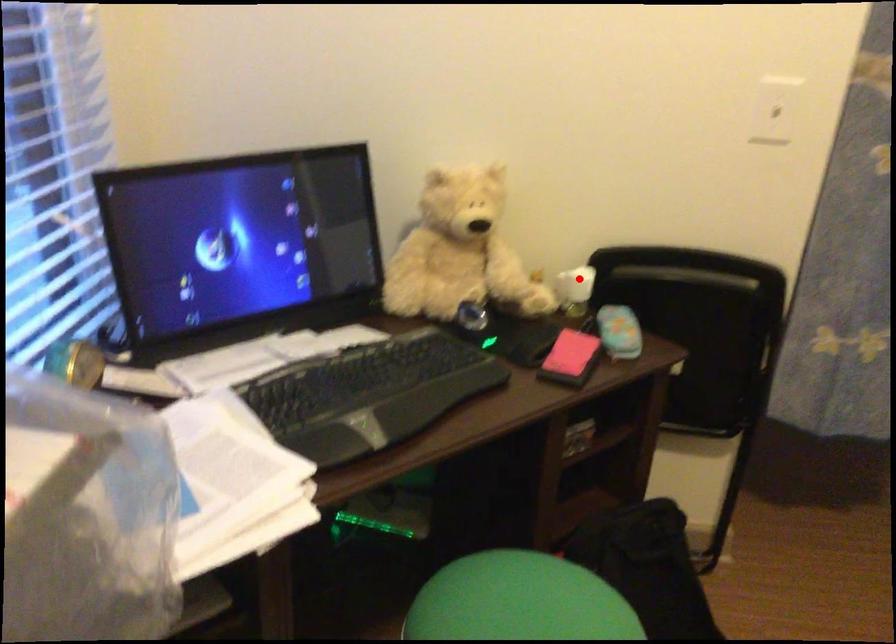
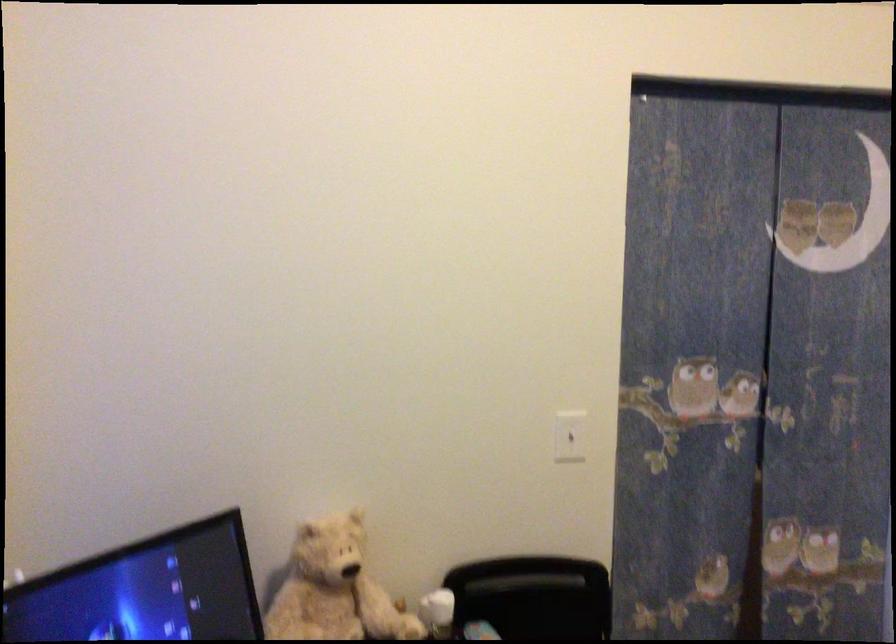
Locate, in the second image, the point that corresponds to the highlighted location in the first image.

(437, 612)